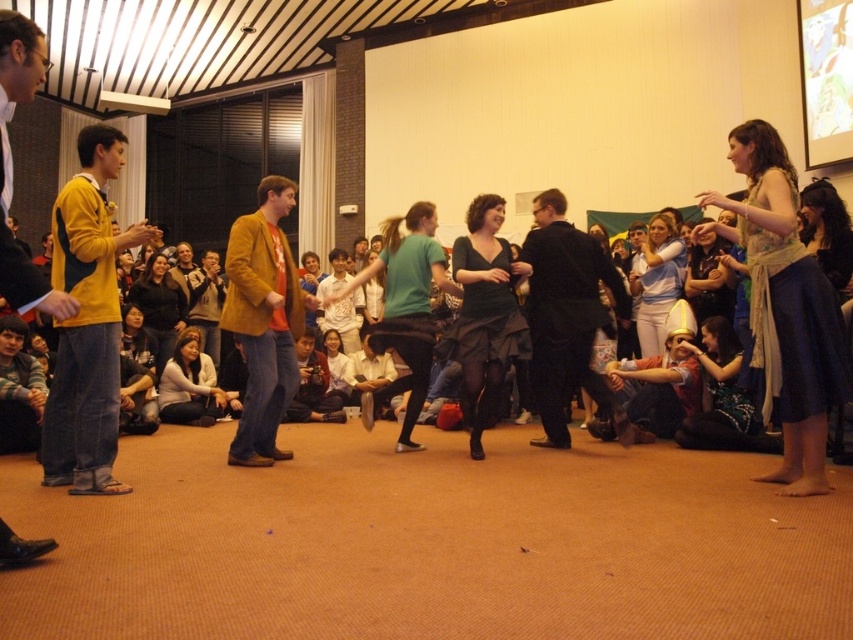
You are standing in the center of the room and see two points marked on the wall. The first point is at coordinate point (328, 323), and the second is at point (344, 369). Which point is closer to you?

Point (328, 323) is closer to you because it is further to the viewer than point (344, 369).

You are organizing a clothing display and need to place the black satin dress at center and the white shirt at center on a rack. Which clothing item requires more space due to its size?

The black satin dress at center requires more space because it has a larger size compared to the white shirt at center.